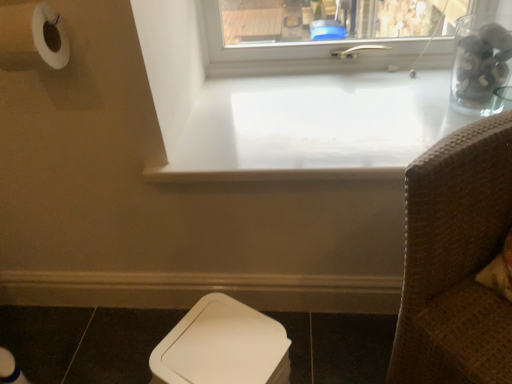
Question: From the image's perspective, is brown woven chair at right above clear glass jar at upper right?

Choices:
 (A) no
 (B) yes

Answer: (A)

Question: From a real-world perspective, is brown woven chair at right located higher than clear glass jar at upper right?

Choices:
 (A) yes
 (B) no

Answer: (B)

Question: Does brown woven chair at right have a larger size compared to clear glass jar at upper right?

Choices:
 (A) yes
 (B) no

Answer: (A)

Question: Would you say brown woven chair at right contains clear glass jar at upper right?

Choices:
 (A) yes
 (B) no

Answer: (B)

Question: Does brown woven chair at right have a lesser height compared to clear glass jar at upper right?

Choices:
 (A) yes
 (B) no

Answer: (B)

Question: Relative to clear glass jar at upper right, is dark brown tile at lower left in front or behind?

Choices:
 (A) behind
 (B) front

Answer: (B)

Question: From a real-world perspective, is dark brown tile at lower left physically located above or below clear glass jar at upper right?

Choices:
 (A) above
 (B) below

Answer: (B)

Question: Is point tap(80, 321) closer or farther from the camera than point tap(222, 49)?

Choices:
 (A) closer
 (B) farther

Answer: (A)

Question: From the image's perspective, is dark brown tile at lower left above or below clear glass jar at upper right?

Choices:
 (A) above
 (B) below

Answer: (B)

Question: Is clear glass jar at upper right bigger or smaller than white plastic toilet bowl at lower center?

Choices:
 (A) big
 (B) small

Answer: (A)

Question: From a real-world perspective, is clear glass jar at upper right physically located above or below white plastic toilet bowl at lower center?

Choices:
 (A) above
 (B) below

Answer: (A)

Question: Is point (404, 64) closer or farther from the camera than point (244, 339)?

Choices:
 (A) farther
 (B) closer

Answer: (A)

Question: Considering their positions, is clear glass jar at upper right located in front of or behind white plastic toilet bowl at lower center?

Choices:
 (A) behind
 (B) front

Answer: (A)

Question: In terms of height, does white plastic toilet bowl at lower center look taller or shorter compared to dark brown tile at lower left?

Choices:
 (A) short
 (B) tall

Answer: (A)

Question: From the image's perspective, is white plastic toilet bowl at lower center positioned above or below dark brown tile at lower left?

Choices:
 (A) above
 (B) below

Answer: (A)